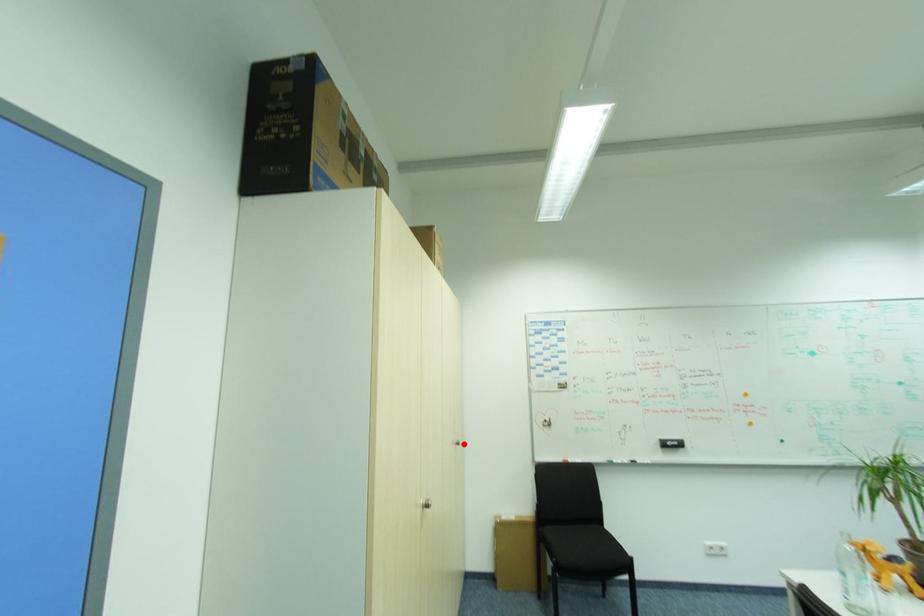
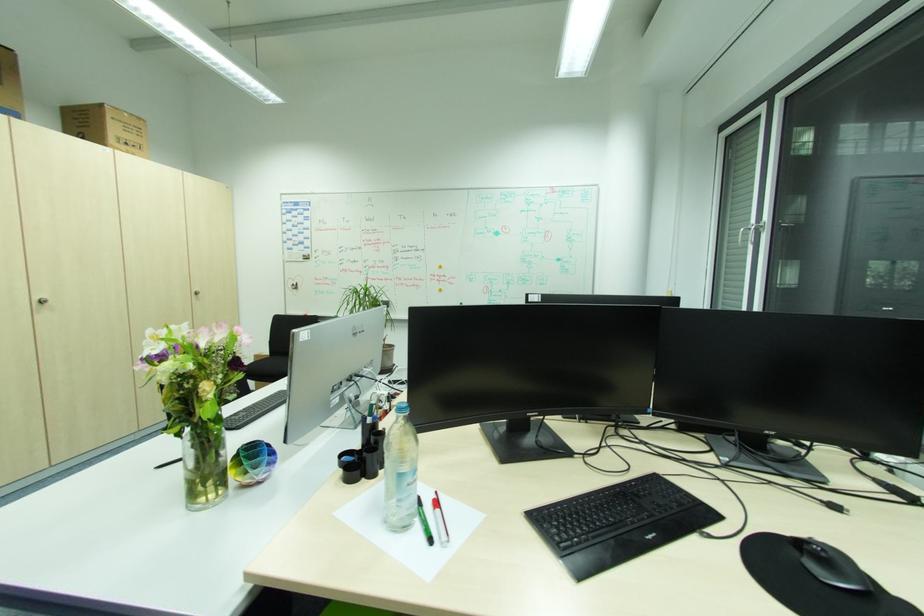
Question: I am providing you with two images of the same scene from different viewpoints. A red point is marked on the first image. At the location where the point appears in image 1, is it still visible in image 2?

Choices:
 (A) Yes
 (B) No

Answer: (A)